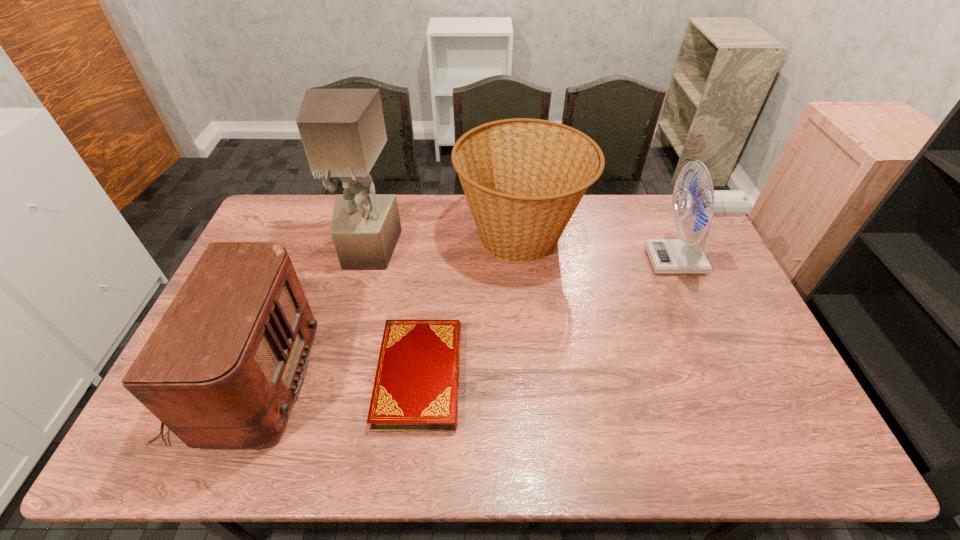
Identify the location of vacant space situated on the front panel of the radio receiver. (365, 379).

I want to click on vacant space located on the cover of the shortest object, so click(411, 461).

Identify the location of sculpture that is at the far edge. (343, 132).

This screenshot has height=540, width=960. In order to click on basket that is at the far edge in this screenshot , I will do `click(523, 178)`.

Where is `radio receiver that is positioned at the near edge`? radio receiver that is positioned at the near edge is located at coordinates click(222, 369).

Where is `hardback book that is at the near edge`? Image resolution: width=960 pixels, height=540 pixels. hardback book that is at the near edge is located at coordinates (416, 388).

The width and height of the screenshot is (960, 540). In order to click on object present at the left edge in this screenshot , I will do `click(222, 369)`.

Image resolution: width=960 pixels, height=540 pixels. I want to click on object that is at the right edge, so click(668, 256).

The image size is (960, 540). I want to click on object located in the near left corner section of the desktop, so click(222, 369).

Where is `vacant space at the far edge of the desktop`? This screenshot has width=960, height=540. vacant space at the far edge of the desktop is located at coordinates (332, 200).